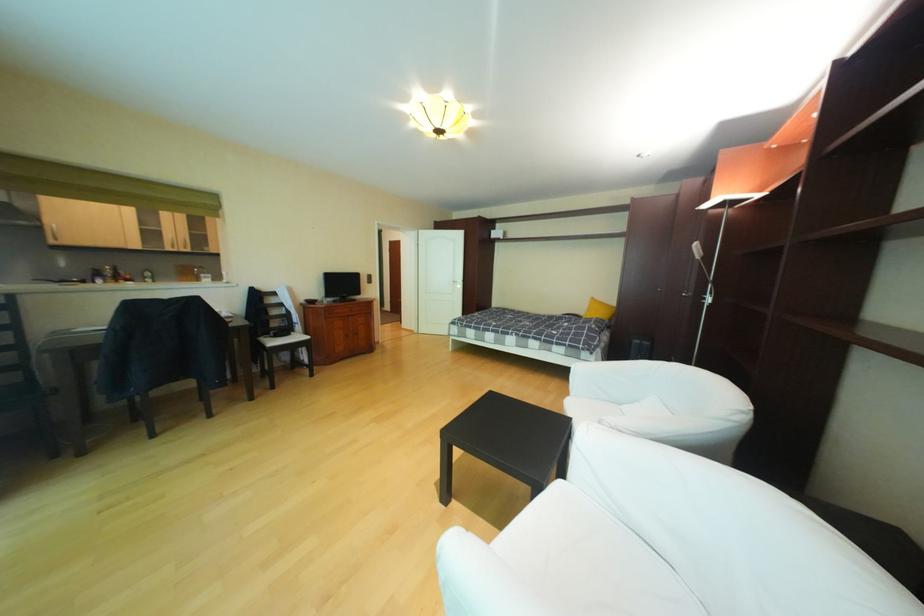
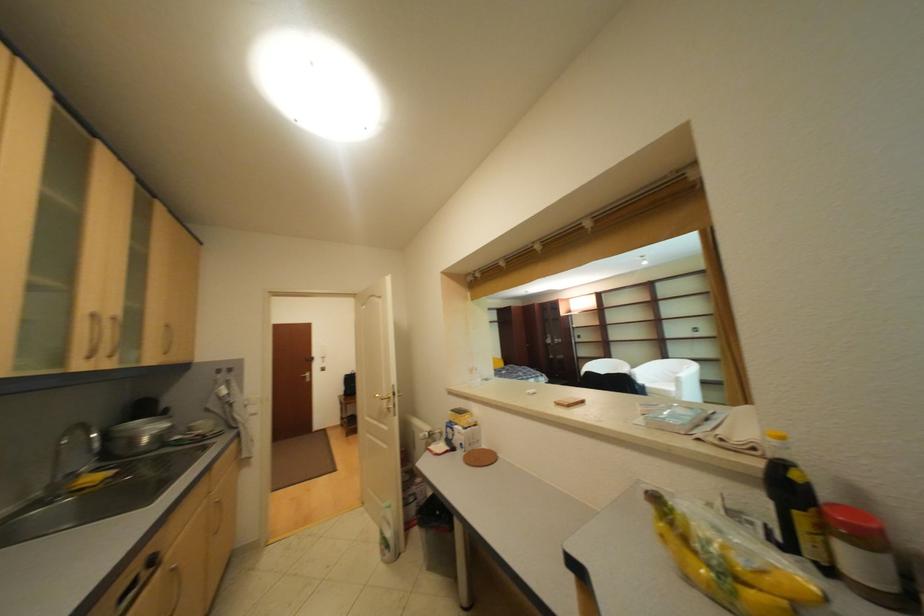
Find the pixel in the second image that matches (186,248) in the first image.

(101, 359)